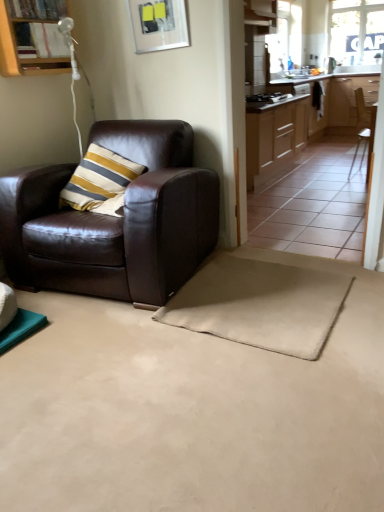
Measure the distance between shiny brown leather armchair at left, marked as the first chair in a bottom-to-top arrangement, and camera.

The distance of shiny brown leather armchair at left, marked as the first chair in a bottom-to-top arrangement, from camera is 2.00 meters.

What do you see at coordinates (115, 220) in the screenshot? I see `shiny brown leather armchair at left, placed as the second chair when sorted from top to bottom` at bounding box center [115, 220].

This screenshot has height=512, width=384. Describe the element at coordinates (299, 76) in the screenshot. I see `white glossy sink at upper center` at that location.

Locate an element on the screen. wooden cabinet at center, arranged as the second cabinetry when viewed from the front is located at coordinates pyautogui.click(x=274, y=135).

In order to face brown leather chair at right, the 2th chair when ordered from front to back, should I rotate leftwards or rightwards?

Rotate your view right by about 22.577°.

The width and height of the screenshot is (384, 512). I want to click on metallic silver picture frame at upper center, so click(159, 24).

Is wooden cabinet at center, arranged as the 2th cabinetry when viewed from the back, smaller than beige suede yoga mat at lower center?

No.

I want to click on the 1st cabinetry counting from the right of the beige suede yoga mat at lower center, so click(x=274, y=135).

Can you see wooden cabinet at center, which appears as the 2th cabinetry when viewed from the right, touching beige suede yoga mat at lower center?

No.

Is wooden cabinet at center, arranged as the 2th cabinetry when viewed from the back, wider than beige suede yoga mat at lower center?

Incorrect, the width of wooden cabinet at center, arranged as the 2th cabinetry when viewed from the back, does not surpass that of beige suede yoga mat at lower center.

From the image's perspective, would you say wooden cabinet at upper left, which is the 3th cabinetry from right to left, is positioned over metallic silver picture frame at upper center?

No.

Is wooden cabinet at upper left, which ranks as the 1th cabinetry in left-to-right order, to the left of metallic silver picture frame at upper center from the viewer's perspective?

Correct, you'll find wooden cabinet at upper left, which ranks as the 1th cabinetry in left-to-right order, to the left of metallic silver picture frame at upper center.

Considering the sizes of objects wooden cabinet at upper left, which ranks as the 1th cabinetry in left-to-right order, and metallic silver picture frame at upper center in the image provided, who is shorter, wooden cabinet at upper left, which ranks as the 1th cabinetry in left-to-right order, or metallic silver picture frame at upper center?

Standing shorter between the two is metallic silver picture frame at upper center.

In the scene shown: In the image, is shiny brown leather armchair at left, acting as the 2th chair starting from the back, positioned in front of or behind brown leather chair at right, the 1th chair positioned from the back?

shiny brown leather armchair at left, acting as the 2th chair starting from the back, is in front of brown leather chair at right, the 1th chair positioned from the back.

At what (x,y) coordinates should I click in order to perform the action: click on chair above the shiny brown leather armchair at left, which appears as the 1th chair when viewed from the left (from the image's perspective). Please return your answer as a coordinate pair (x, y). Looking at the image, I should click on (364, 128).

Between shiny brown leather armchair at left, the 2th chair positioned from the right, and brown leather chair at right, which is counted as the 2th chair, starting from the bottom, which one has larger size?

Bigger between the two is shiny brown leather armchair at left, the 2th chair positioned from the right.

From the image's perspective, is wooden cabinet at center, arranged as the second cabinetry when viewed from the front, above or below transparent glass window at upper right?

From the image's perspective, wooden cabinet at center, arranged as the second cabinetry when viewed from the front, appears below transparent glass window at upper right.

Where is `cabinetry that is the 3rd object directly below the transparent glass window at upper right (from a real-world perspective)`? This screenshot has height=512, width=384. cabinetry that is the 3rd object directly below the transparent glass window at upper right (from a real-world perspective) is located at coordinates (274, 135).

Which of these two, wooden cabinet at center, which appears as the 2th cabinetry when viewed from the right, or transparent glass window at upper right, is thinner?

With smaller width is transparent glass window at upper right.

From a real-world perspective, is wooden cabinet at center, which appears as the 2th cabinetry when viewed from the right, beneath transparent glass window at upper right?

Yes, from a real-world perspective, wooden cabinet at center, which appears as the 2th cabinetry when viewed from the right, is beneath transparent glass window at upper right.

How much distance is there between brown leather chair at right, which is counted as the 2th chair, starting from the bottom, and beige suede yoga mat at lower center?

brown leather chair at right, which is counted as the 2th chair, starting from the bottom, and beige suede yoga mat at lower center are 3.33 meters apart from each other.

What's the angular difference between brown leather chair at right, which is the 2th chair from left to right, and beige suede yoga mat at lower center's facing directions?

There is a 89.6-degree angle between the facing directions of brown leather chair at right, which is the 2th chair from left to right, and beige suede yoga mat at lower center.

Is point (370, 128) positioned behind point (280, 311)?

Yes, point (370, 128) is farther from viewer.

Looking at this image, considering the sizes of brown leather chair at right, the 1th chair positioned from the back, and beige suede yoga mat at lower center in the image, is brown leather chair at right, the 1th chair positioned from the back, bigger or smaller than beige suede yoga mat at lower center?

Considering their sizes, brown leather chair at right, the 1th chair positioned from the back, takes up more space than beige suede yoga mat at lower center.

Based on the photo, can you see wooden cabinet at upper left, which ranks as the 1th cabinetry in left-to-right order, touching shiny brown leather armchair at left, the 2th chair positioned from the right?

wooden cabinet at upper left, which ranks as the 1th cabinetry in left-to-right order, is not next to shiny brown leather armchair at left, the 2th chair positioned from the right, and they're not touching.

Which of these two, wooden cabinet at upper left, which is the 3th cabinetry from right to left, or shiny brown leather armchair at left, the 2th chair positioned from the right, is bigger?

shiny brown leather armchair at left, the 2th chair positioned from the right.

From the image's perspective, which is below, wooden cabinet at upper left, which appears as the 1th cabinetry when viewed from the front, or shiny brown leather armchair at left, marked as the first chair in a bottom-to-top arrangement?

From the image's view, shiny brown leather armchair at left, marked as the first chair in a bottom-to-top arrangement, is below.

Considering the relative sizes of wooden cabinet at upper left, the third cabinetry when ordered from back to front, and shiny brown leather armchair at left, placed as the second chair when sorted from top to bottom, in the image provided, is wooden cabinet at upper left, the third cabinetry when ordered from back to front, wider than shiny brown leather armchair at left, placed as the second chair when sorted from top to bottom,?

In fact, wooden cabinet at upper left, the third cabinetry when ordered from back to front, might be narrower than shiny brown leather armchair at left, placed as the second chair when sorted from top to bottom.

Is light wood cabinetry at center, which ranks as the third cabinetry in left-to-right order, positioned with its back to white glossy sink at upper center?

No, light wood cabinetry at center, which ranks as the third cabinetry in left-to-right order, is not facing the opposite direction of white glossy sink at upper center.

Which object is positioned more to the left, light wood cabinetry at center, the 3th cabinetry viewed from the front, or white glossy sink at upper center?

white glossy sink at upper center.

Based on the photo, is light wood cabinetry at center, the 3th cabinetry viewed from the front, behind white glossy sink at upper center?

Yes, the depth of light wood cabinetry at center, the 3th cabinetry viewed from the front, is greater than that of white glossy sink at upper center.

Would you say light wood cabinetry at center, the 3th cabinetry viewed from the front, contains white glossy sink at upper center?

That's incorrect, white glossy sink at upper center is not inside light wood cabinetry at center, the 3th cabinetry viewed from the front.

The height and width of the screenshot is (512, 384). I want to click on yoga mat lying on the left of wooden cabinet at center, arranged as the second cabinetry when viewed from the front, so click(260, 304).

Where is `cabinetry in front of the metallic silver picture frame at upper center`? This screenshot has width=384, height=512. cabinetry in front of the metallic silver picture frame at upper center is located at coordinates (32, 38).

Looking at the image, which one is located further to beige suede yoga mat at lower center, transparent glass window at upper right or metallic silver picture frame at upper center?

The object further to beige suede yoga mat at lower center is transparent glass window at upper right.

Estimate the real-world distances between objects in this image. Which object is closer to wooden cabinet at upper left, which is the 3th cabinetry from right to left, transparent glass window at upper right or light wood cabinetry at center, the 3th cabinetry viewed from the front?

light wood cabinetry at center, the 3th cabinetry viewed from the front.

Which object lies further to the anchor point light wood cabinetry at center, which ranks as the third cabinetry in left-to-right order, beige suede yoga mat at lower center or white glossy sink at upper center?

beige suede yoga mat at lower center is positioned further to the anchor light wood cabinetry at center, which ranks as the third cabinetry in left-to-right order.

Which object lies further to the anchor point brown leather chair at right, the 2th chair when ordered from front to back, metallic silver picture frame at upper center or wooden cabinet at center, arranged as the second cabinetry when viewed from the front?

metallic silver picture frame at upper center is positioned further to the anchor brown leather chair at right, the 2th chair when ordered from front to back.

Looking at this image, from the image, which object appears to be farther from shiny brown leather armchair at left, acting as the 2th chair starting from the back, transparent glass window at upper right or white glossy sink at upper center?

transparent glass window at upper right is further to shiny brown leather armchair at left, acting as the 2th chair starting from the back.

Considering their positions, is brown leather chair at right, the 2th chair when ordered from front to back, positioned further to light wood cabinetry at center, which ranks as the third cabinetry in left-to-right order, than beige suede yoga mat at lower center?

Based on the image, beige suede yoga mat at lower center appears to be further to light wood cabinetry at center, which ranks as the third cabinetry in left-to-right order.

Estimate the real-world distances between objects in this image. Which object is closer to white glossy sink at upper center, light wood cabinetry at center, the first cabinetry when ordered from right to left, or brown leather chair at right, which is counted as the 2th chair, starting from the bottom?

light wood cabinetry at center, the first cabinetry when ordered from right to left, is closer to white glossy sink at upper center.

Considering their positions, is light wood cabinetry at center, the first cabinetry when ordered from back to front, positioned closer to shiny brown leather armchair at left, placed as the second chair when sorted from top to bottom, than metallic silver picture frame at upper center?

Among the two, metallic silver picture frame at upper center is located nearer to shiny brown leather armchair at left, placed as the second chair when sorted from top to bottom.

Identify the location of picture frame between wooden cabinet at upper left, which is the 3th cabinetry from right to left, and white glossy sink at upper center in the front-back direction. (159, 24).

Identify the location of sink between transparent glass window at upper right and light wood cabinetry at center, the first cabinetry when ordered from right to left, in the up-down direction. The image size is (384, 512). (299, 76).

The height and width of the screenshot is (512, 384). What are the coordinates of `picture frame positioned between beige suede yoga mat at lower center and brown leather chair at right, which is the 2th chair from left to right, from near to far` in the screenshot? It's located at (159, 24).

The image size is (384, 512). Identify the location of chair located between wooden cabinet at center, arranged as the second cabinetry when viewed from the front, and transparent glass window at upper right in the depth direction. (364, 128).